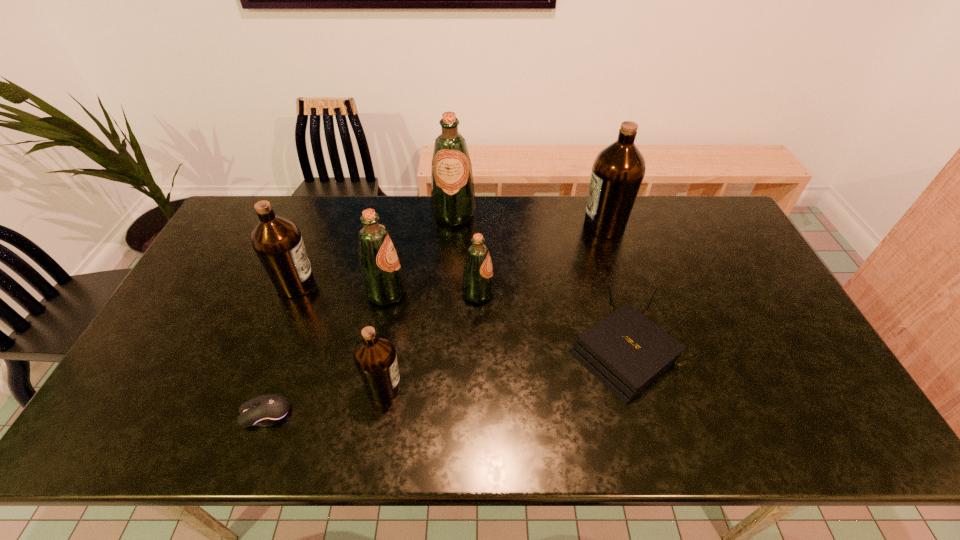
Where is `the farthest brown olive oil`? The height and width of the screenshot is (540, 960). the farthest brown olive oil is located at coordinates click(618, 170).

Where is `the biggest brown olive oil`? the biggest brown olive oil is located at coordinates (618, 170).

This screenshot has width=960, height=540. I want to click on the farthest green olive oil, so click(453, 203).

You are a GUI agent. You are given a task and a screenshot of the screen. Output one action in this format:
    pyautogui.click(x=<x>, y=<y>)
    Task: Click on the second biggest green olive oil
    The height and width of the screenshot is (540, 960).
    Given the screenshot: What is the action you would take?
    pyautogui.click(x=382, y=277)

This screenshot has height=540, width=960. I want to click on the second nearest brown olive oil, so click(277, 241).

Locate an element on the screen. the leftmost olive oil is located at coordinates (277, 241).

You are a GUI agent. You are given a task and a screenshot of the screen. Output one action in this format:
    pyautogui.click(x=<x>, y=<y>)
    Task: Click on the smallest green olive oil
    The image size is (960, 540).
    Given the screenshot: What is the action you would take?
    pyautogui.click(x=478, y=284)

This screenshot has width=960, height=540. I want to click on the nearest olive oil, so click(x=375, y=358).

This screenshot has height=540, width=960. Identify the location of the second brown olive oil from right to left. (375, 358).

You are a GUI agent. You are given a task and a screenshot of the screen. Output one action in this format:
    pyautogui.click(x=<x>, y=<y>)
    Task: Click on the black router
    
    Given the screenshot: What is the action you would take?
    pyautogui.click(x=626, y=351)